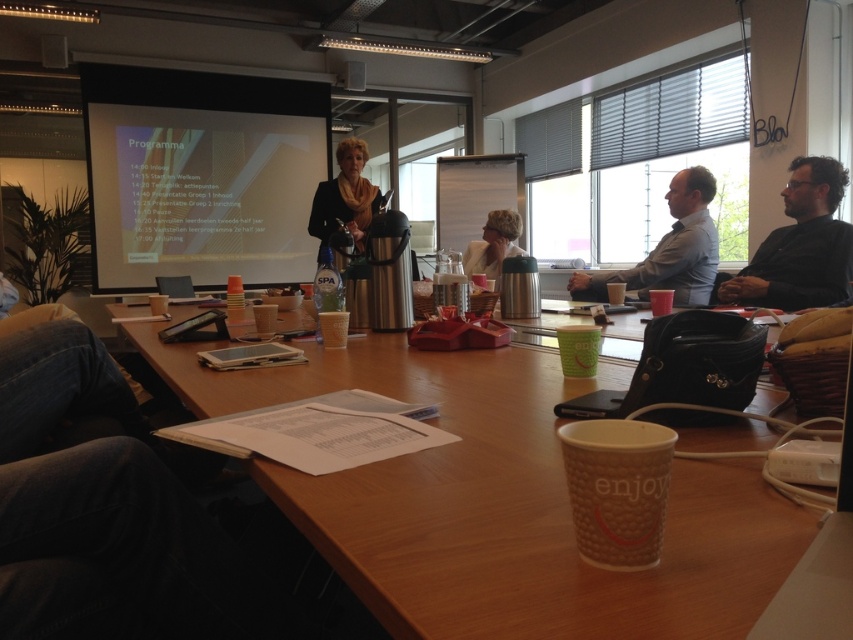
Question: Does black matte shirt at right come behind black fabric jacket at center?

Choices:
 (A) yes
 (B) no

Answer: (B)

Question: Which object appears closest to the camera in this image?

Choices:
 (A) white matte jacket at center
 (B) brown paper cup at center

Answer: (B)

Question: Does brown paper cup at center have a smaller size compared to white matte projection screen at upper left?

Choices:
 (A) no
 (B) yes

Answer: (B)

Question: Which point is farther from the camera taking this photo?

Choices:
 (A) (712, 541)
 (B) (809, 268)
 (C) (178, 224)
 (D) (341, 208)

Answer: (C)

Question: Which of these objects is positioned farthest from the matte blue shirt at upper right?

Choices:
 (A) brown paper cup at center
 (B) white matte projection screen at upper left
 (C) black fabric jacket at center
 (D) black matte shirt at right

Answer: (B)

Question: In this image, where is brown paper cup at center located relative to white matte jacket at center?

Choices:
 (A) below
 (B) above

Answer: (A)